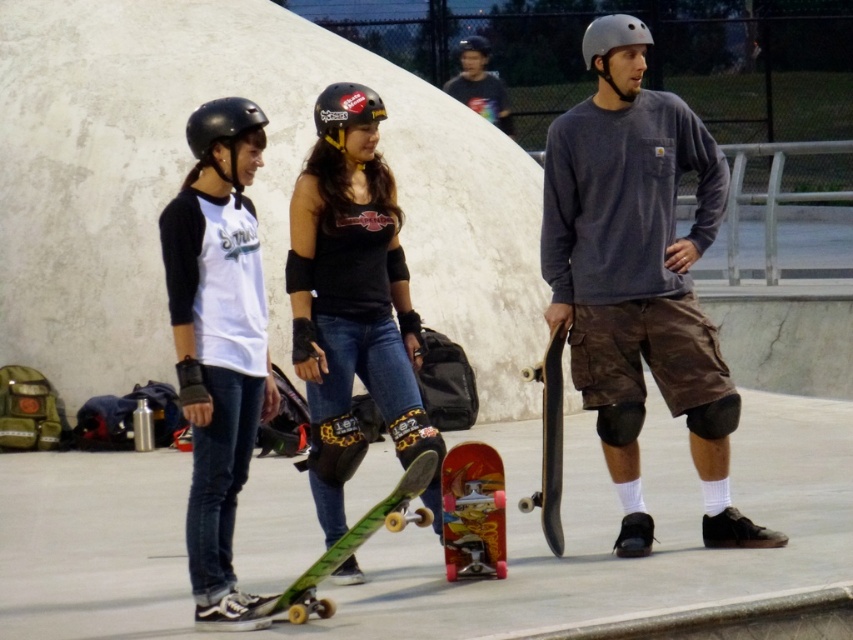
Does matte gray helmet at center lie in front of green matte skateboard at center?

No, matte gray helmet at center is further to the viewer.

Can you confirm if matte gray helmet at center is positioned to the right of green matte skateboard at center?

Correct, you'll find matte gray helmet at center to the right of green matte skateboard at center.

The image size is (853, 640). What do you see at coordinates (640, 288) in the screenshot? I see `matte gray helmet at center` at bounding box center [640, 288].

The image size is (853, 640). Identify the location of matte gray helmet at center. [640, 288].

Which is behind, point (320, 100) or point (616, 33)?

Positioned behind is point (616, 33).

Can you confirm if black matte helmet at center is thinner than matte black helmet at center?

Incorrect, black matte helmet at center's width is not less than matte black helmet at center's.

Is point (339, 134) farther from viewer compared to point (648, 35)?

No.

At what (x,y) coordinates should I click in order to perform the action: click on black matte helmet at center. Please return your answer as a coordinate pair (x, y). Looking at the image, I should click on (345, 109).

Is green matte skateboard at center smaller than matte black helmet at left?

No.

Does point (289, 604) come behind point (194, 145)?

No, it is not.

Measure the distance between green matte skateboard at center and camera.

A distance of 10.25 meters exists between green matte skateboard at center and camera.

At what (x,y) coordinates should I click in order to perform the action: click on green matte skateboard at center. Please return your answer as a coordinate pair (x, y). This screenshot has width=853, height=640. Looking at the image, I should click on (352, 545).